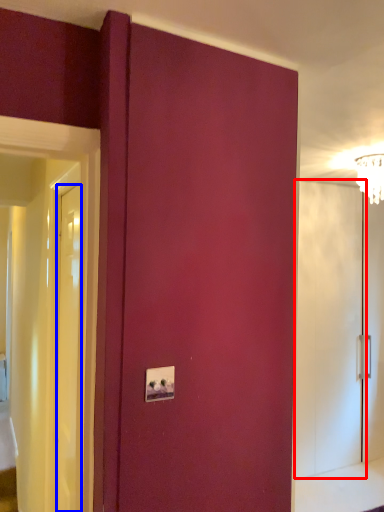
Question: Which point is further to the camera, screen door (highlighted by a red box) or door (highlighted by a blue box)?

Choices:
 (A) screen door
 (B) door

Answer: (A)